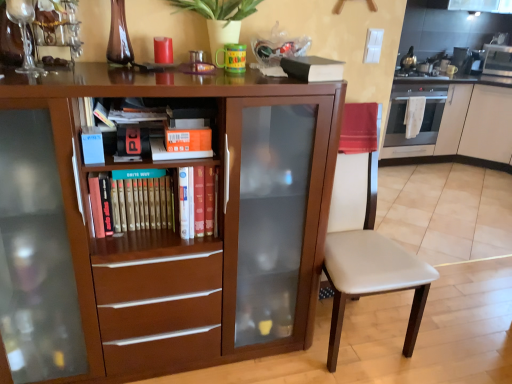
Question: Which direction should I rotate to look at brown matte cabinet at center, placed as the second cabinetry when sorted from right to left, — up or down?

Choices:
 (A) down
 (B) up

Answer: (A)

Question: Can you confirm if brown matte cabinet at center, placed as the 1th cabinetry when sorted from left to right, is positioned to the right of hardcover book at center?

Choices:
 (A) no
 (B) yes

Answer: (A)

Question: Considering the relative sizes of brown matte cabinet at center, placed as the second cabinetry when sorted from right to left, and hardcover book at center in the image provided, is brown matte cabinet at center, placed as the second cabinetry when sorted from right to left, wider than hardcover book at center?

Choices:
 (A) no
 (B) yes

Answer: (B)

Question: From the image's perspective, is brown matte cabinet at center, placed as the second cabinetry when sorted from right to left, beneath hardcover book at center?

Choices:
 (A) yes
 (B) no

Answer: (A)

Question: Is brown matte cabinet at center, placed as the 1th cabinetry when sorted from left to right, next to hardcover book at center and touching it?

Choices:
 (A) no
 (B) yes

Answer: (A)

Question: From a real-world perspective, is brown matte cabinet at center, placed as the second cabinetry when sorted from right to left, on hardcover book at center?

Choices:
 (A) yes
 (B) no

Answer: (B)

Question: Does brown matte cabinet at center, placed as the second cabinetry when sorted from right to left, have a smaller size compared to hardcover book at center?

Choices:
 (A) no
 (B) yes

Answer: (A)

Question: From the image's perspective, is brown matte cabinet at center, placed as the 1th cabinetry when sorted from left to right, over green matte plant at upper center?

Choices:
 (A) no
 (B) yes

Answer: (A)

Question: Considering the relative sizes of brown matte cabinet at center, placed as the 1th cabinetry when sorted from left to right, and green matte plant at upper center in the image provided, is brown matte cabinet at center, placed as the 1th cabinetry when sorted from left to right, smaller than green matte plant at upper center?

Choices:
 (A) no
 (B) yes

Answer: (A)

Question: Is brown matte cabinet at center, placed as the 2th cabinetry when sorted from back to front, facing towards green matte plant at upper center?

Choices:
 (A) yes
 (B) no

Answer: (B)

Question: Does brown matte cabinet at center, placed as the second cabinetry when sorted from right to left, come behind green matte plant at upper center?

Choices:
 (A) no
 (B) yes

Answer: (A)

Question: Is brown matte cabinet at center, placed as the 1th cabinetry when sorted from left to right, outside of green matte plant at upper center?

Choices:
 (A) no
 (B) yes

Answer: (B)

Question: Does brown matte cabinet at center, placed as the 2th cabinetry when sorted from back to front, have a greater width compared to green matte plant at upper center?

Choices:
 (A) no
 (B) yes

Answer: (B)

Question: Are white glossy cabinet at right, arranged as the 2th cabinetry when viewed from the left, and hardcover book at left, the 1th paperback book when ordered from left to right, making contact?

Choices:
 (A) yes
 (B) no

Answer: (B)